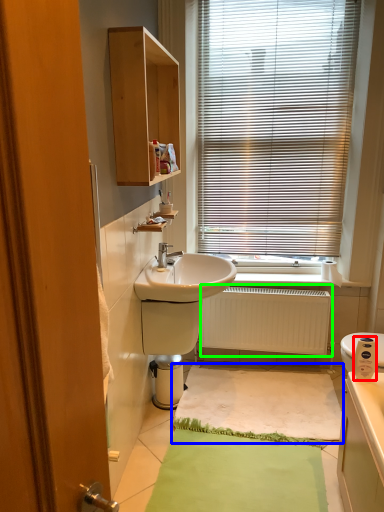
Question: Which is nearer to the appliance (highlighted by a red box)? bath mat (highlighted by a blue box) or radiator (highlighted by a green box).

Choices:
 (A) bath mat
 (B) radiator

Answer: (B)